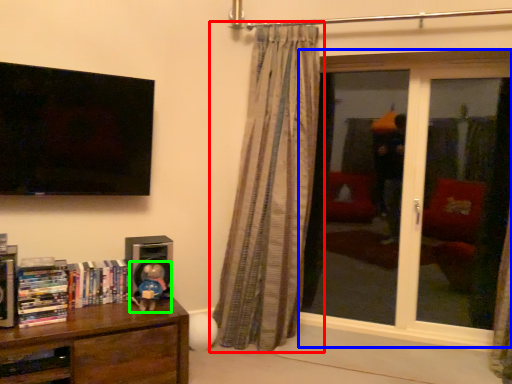
Question: Considering the real-world distances, which object is closest to curtain (highlighted by a red box)? window (highlighted by a blue box) or toy (highlighted by a green box).

Choices:
 (A) window
 (B) toy

Answer: (A)